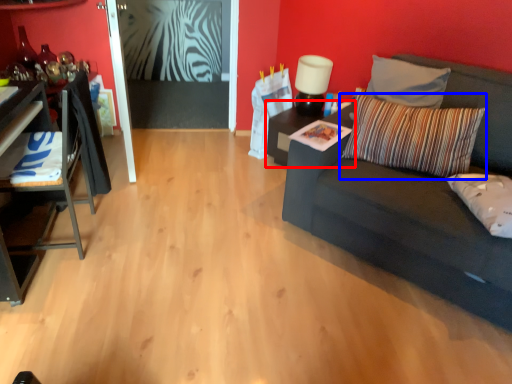
Question: Among these objects, which one is nearest to the camera, table (highlighted by a red box) or pillow (highlighted by a blue box)?

Choices:
 (A) table
 (B) pillow

Answer: (B)